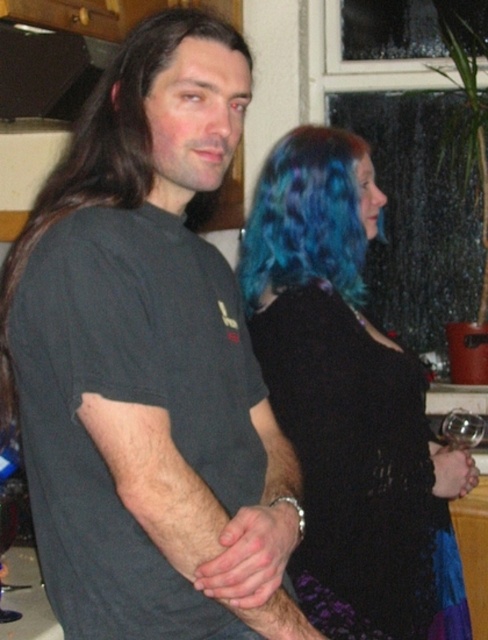
Question: Can you confirm if black lace dress at center is positioned above blue dyed hair at upper right?

Choices:
 (A) yes
 (B) no

Answer: (B)

Question: Can you confirm if blue dyed hair at upper right is wider than clear glass wine glass at lower left?

Choices:
 (A) yes
 (B) no

Answer: (A)

Question: Which point is closer to the camera?

Choices:
 (A) black lace dress at center
 (B) clear glass wine glass at lower left

Answer: (B)

Question: Among these points, which one is nearest to the camera?

Choices:
 (A) (8, 536)
 (B) (312, 227)
 (C) (206, 32)
 (D) (340, 268)

Answer: (C)

Question: Is black lace dress at center to the left of black matte hair at left from the viewer's perspective?

Choices:
 (A) yes
 (B) no

Answer: (B)

Question: Estimate the real-world distances between objects in this image. Which object is farther from the black lace dress at center?

Choices:
 (A) blue dyed hair at upper right
 (B) clear glass wine glass at lower left

Answer: (B)